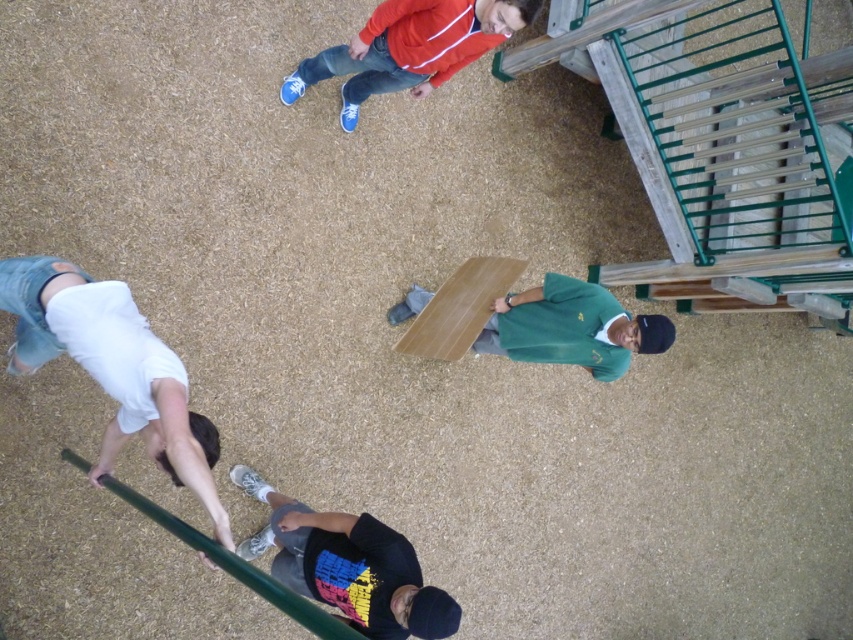
Can you confirm if white cotton shirt at lower left is wider than black matte t-shirt at lower center?

Indeed, white cotton shirt at lower left has a greater width compared to black matte t-shirt at lower center.

Is white cotton shirt at lower left bigger than black matte t-shirt at lower center?

Correct, white cotton shirt at lower left is larger in size than black matte t-shirt at lower center.

Image resolution: width=853 pixels, height=640 pixels. What do you see at coordinates (115, 369) in the screenshot? I see `white cotton shirt at lower left` at bounding box center [115, 369].

Find the location of a particular element. Image resolution: width=853 pixels, height=640 pixels. white cotton shirt at lower left is located at coordinates (115, 369).